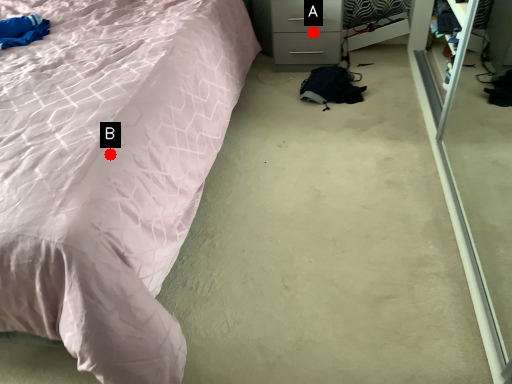
Question: Two points are circled on the image, labeled by A and B beside each circle. Which point appears farthest from the camera in this image?

Choices:
 (A) A is further
 (B) B is further

Answer: (A)